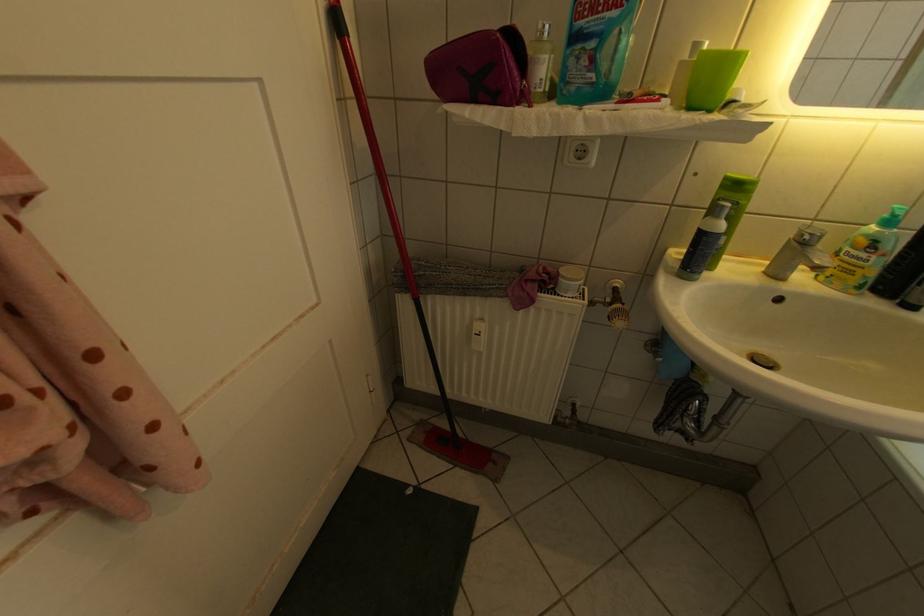
Where is `faucet handle`? The image size is (924, 616). faucet handle is located at coordinates (798, 254).